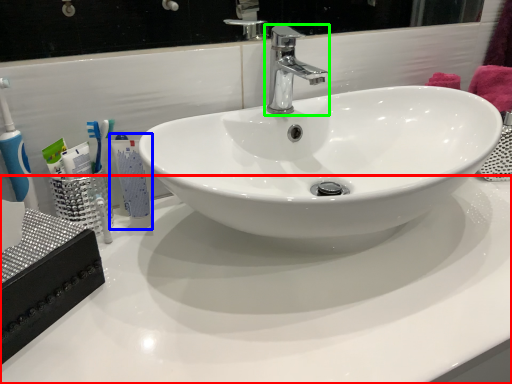
Question: Estimate the real-world distances between objects in this image. Which object is closer to counter top (highlighted by a red box), mouthwash (highlighted by a blue box) or tap (highlighted by a green box)?

Choices:
 (A) mouthwash
 (B) tap

Answer: (A)